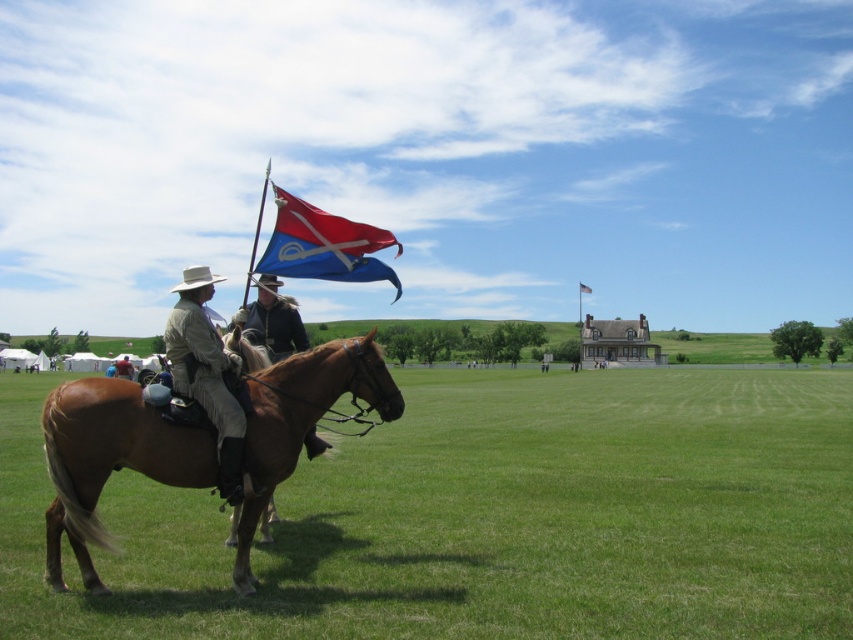
From the picture: Can you confirm if green grass at lower left is positioned to the right of red fabric flag at center?

Incorrect, green grass at lower left is not on the right side of red fabric flag at center.

Between green grass at lower left and red fabric flag at center, which one has less height?

With less height is green grass at lower left.

Is point (445, 403) positioned after point (578, 289)?

No, (445, 403) is in front of (578, 289).

Identify the location of green grass at lower left. Image resolution: width=853 pixels, height=640 pixels. (486, 516).

Does blue fabric flag at center lie behind khaki fabric pants at lower left?

No, it is in front of khaki fabric pants at lower left.

What do you see at coordinates (323, 244) in the screenshot? The width and height of the screenshot is (853, 640). I see `blue fabric flag at center` at bounding box center [323, 244].

The image size is (853, 640). I want to click on blue fabric flag at center, so 323,244.

Between light brown leather jacket at left and dark brown leather jacket at center, which one has less height?

With less height is dark brown leather jacket at center.

Is light brown leather jacket at left above dark brown leather jacket at center?

Incorrect, light brown leather jacket at left is not positioned above dark brown leather jacket at center.

Between point (207, 340) and point (267, 314), which one is positioned behind?

Point (267, 314)

Identify the location of light brown leather jacket at left. (206, 372).